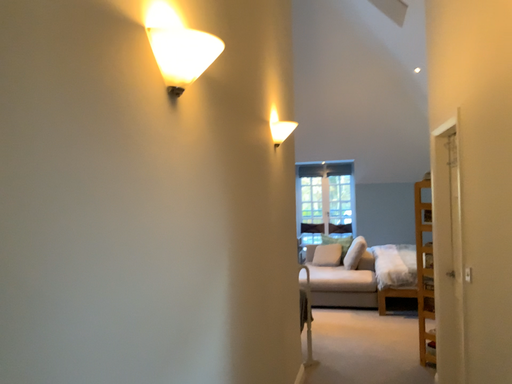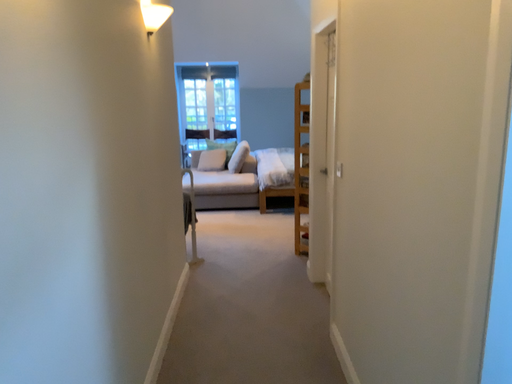
Question: How did the camera likely rotate when shooting the video?

Choices:
 (A) rotated left
 (B) rotated right

Answer: (B)